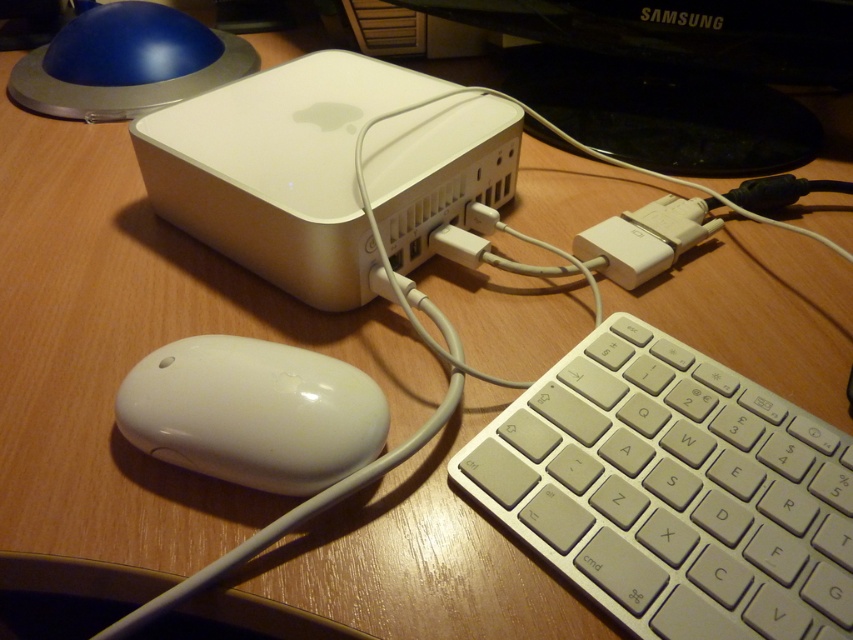
From the picture: Does white plastic keyboard at lower right come behind white glossy mouse at lower left?

That is False.

Which is more to the left, white plastic keyboard at lower right or white glossy mouse at lower left?

white glossy mouse at lower left

Image resolution: width=853 pixels, height=640 pixels. Describe the element at coordinates (672, 492) in the screenshot. I see `white plastic keyboard at lower right` at that location.

The image size is (853, 640). Identify the location of white plastic keyboard at lower right. (672, 492).

Is black glossy monitor at upper center shorter than white plastic plug at center right?

No.

This screenshot has height=640, width=853. Find the location of `black glossy monitor at upper center`. black glossy monitor at upper center is located at coordinates (672, 74).

Is black glossy monitor at upper center wider than white glossy mouse at lower left?

Indeed, black glossy monitor at upper center has a greater width compared to white glossy mouse at lower left.

Identify the location of black glossy monitor at upper center. The image size is (853, 640). (672, 74).

Where is `black glossy monitor at upper center`? This screenshot has width=853, height=640. black glossy monitor at upper center is located at coordinates (672, 74).